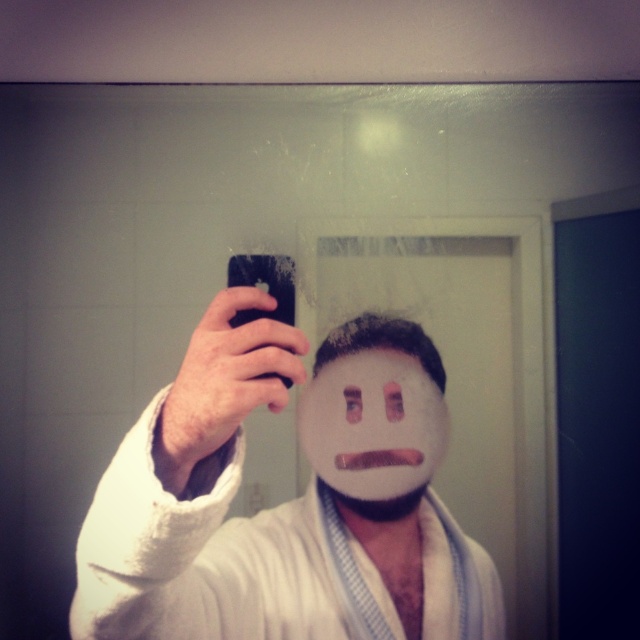
Is white towel at center above white matte mask at center?

No, white towel at center is not above white matte mask at center.

Which is behind, point (202, 568) or point (388, 353)?

Point (388, 353)

Is point (154, 561) behind point (371, 449)?

No, (154, 561) is in front of (371, 449).

At what (x,y) coordinates should I click in order to perform the action: click on white towel at center. Please return your answer as a coordinate pair (x, y). The image size is (640, 640). Looking at the image, I should click on (280, 504).